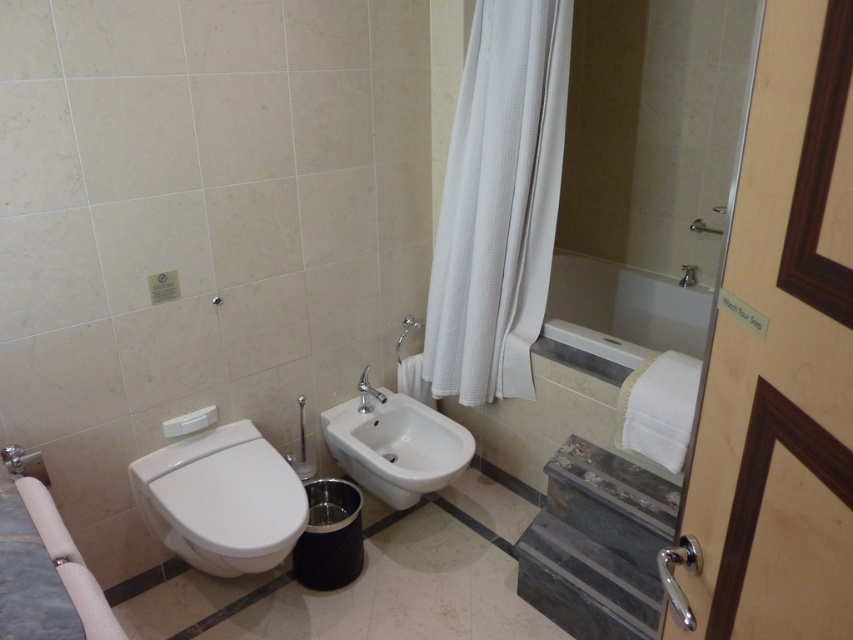
Between white glossy sink at center and matte silver faucet at upper center, which one is positioned higher?

matte silver faucet at upper center is higher up.

Which is behind, point (439, 470) or point (399, 344)?

Point (399, 344)

Where is `white glossy sink at center`? white glossy sink at center is located at coordinates (396, 445).

Does point (479, 257) lie behind point (645, 323)?

No, (479, 257) is closer to viewer.

Who is positioned more to the right, white waffle-textured curtain at center-right or white glossy bathtub at center?

white glossy bathtub at center

The width and height of the screenshot is (853, 640). What do you see at coordinates (498, 202) in the screenshot? I see `white waffle-textured curtain at center-right` at bounding box center [498, 202].

Find the location of a particular element. white waffle-textured curtain at center-right is located at coordinates (498, 202).

Does white waffle-textured curtain at center-right appear over white glossy bidet at lower left?

Indeed, white waffle-textured curtain at center-right is positioned over white glossy bidet at lower left.

Based on the photo, can you confirm if white waffle-textured curtain at center-right is positioned below white glossy bidet at lower left?

Incorrect, white waffle-textured curtain at center-right is not positioned below white glossy bidet at lower left.

At what (x,y) coordinates should I click in order to perform the action: click on white waffle-textured curtain at center-right. Please return your answer as a coordinate pair (x, y). The image size is (853, 640). Looking at the image, I should click on (498, 202).